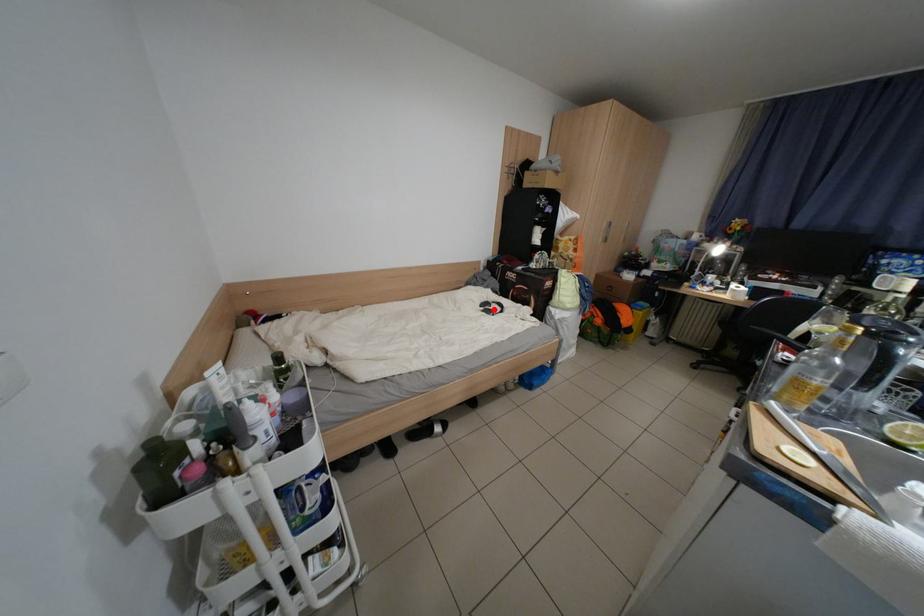
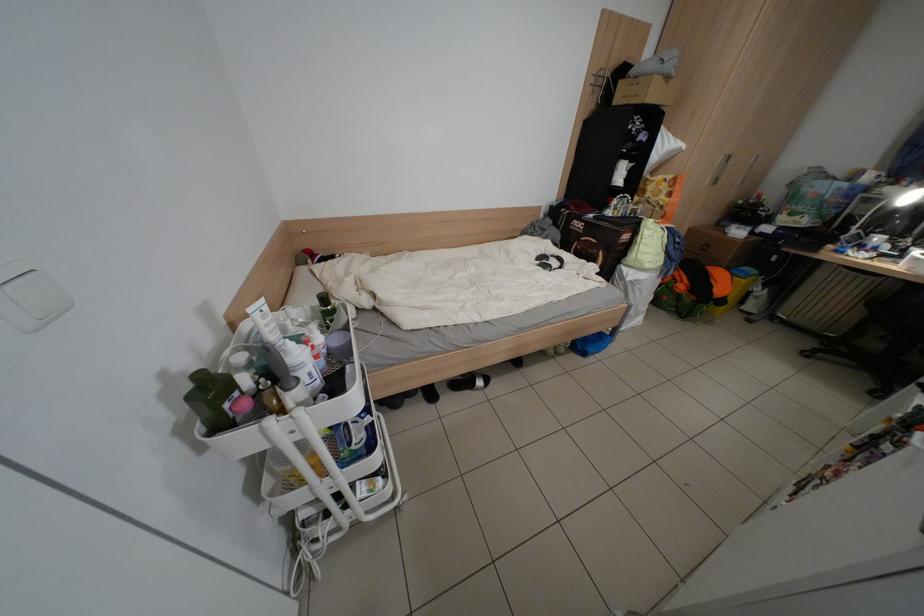
The point at the highlighted location is marked in the first image. Where is the corresponding point in the second image?

(550, 264)